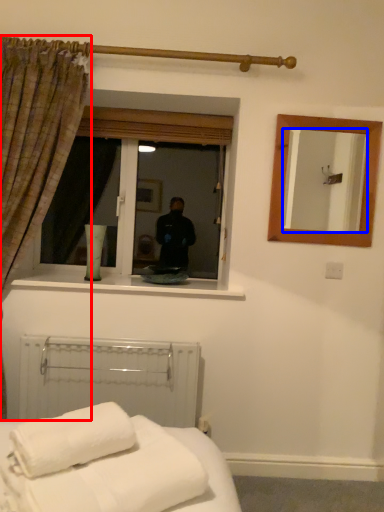
Question: Which point is closer to the camera, curtain (highlighted by a red box) or mirror (highlighted by a blue box)?

Choices:
 (A) curtain
 (B) mirror

Answer: (A)